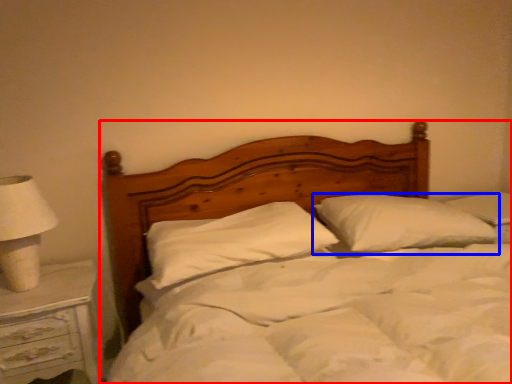
Question: Which object is further to the camera taking this photo, bed (highlighted by a red box) or pillow (highlighted by a blue box)?

Choices:
 (A) bed
 (B) pillow

Answer: (B)